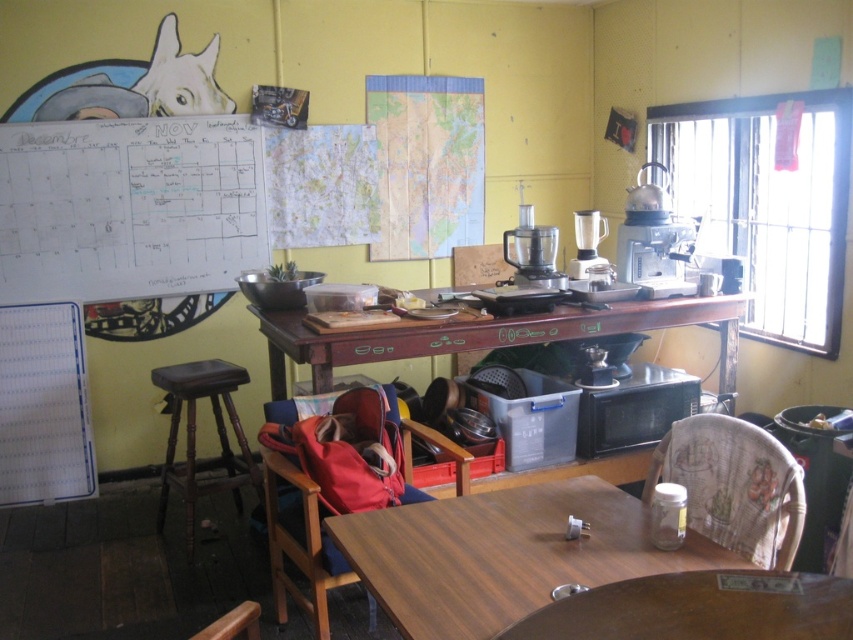
Question: Is wooden table at center thinner than white plastic blender at center?

Choices:
 (A) yes
 (B) no

Answer: (B)

Question: Considering the real-world distances, which object is closest to the red fabric chair at center?

Choices:
 (A) wooden table at center
 (B) wooden table at lower center
 (C) white fabric chair at lower right
 (D) white plastic blender at center

Answer: (A)

Question: Which point is farther from the camera taking this photo?

Choices:
 (A) (331, 336)
 (B) (581, 275)

Answer: (B)

Question: Which point appears closest to the camera in this image?

Choices:
 (A) (730, 524)
 (B) (337, 419)
 (C) (640, 522)

Answer: (C)

Question: Is red fabric chair at center thinner than dark wood stool at lower left?

Choices:
 (A) yes
 (B) no

Answer: (B)

Question: Does white fabric chair at lower right have a greater width compared to white plastic blender at center?

Choices:
 (A) yes
 (B) no

Answer: (A)